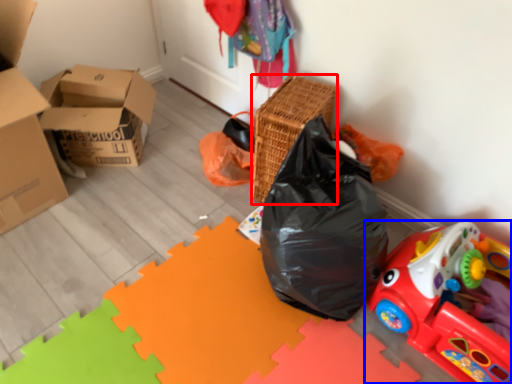
Question: Which of the following is the closest to the observer, basket (highlighted by a red box) or toy (highlighted by a blue box)?

Choices:
 (A) basket
 (B) toy

Answer: (B)